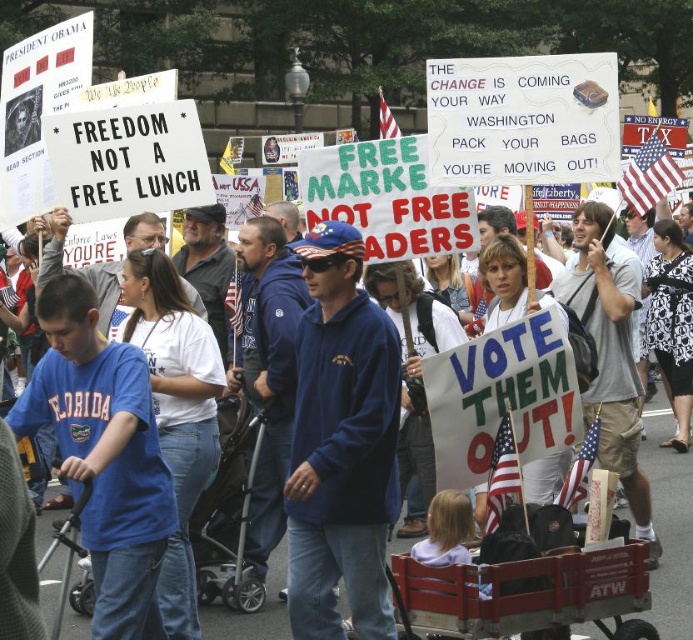
You are a photographer standing at the edge of the protest crowd. You want to take a photo that includes both the blue fleece jacket at center and the blue cotton shirt at center. The camera you have can focus on objects within a 3.5 meter range. Will both subjects be in focus?

The blue fleece jacket at center is 3.75 meters away from blue cotton shirt at center. Since the camera can only focus within 3.5 meters, the distance between them exceeds the focus range. Therefore, both subjects cannot be in focus simultaneously.

You are a photographer trying to capture a clear shot of the blue cotton shirt at center and the blue sweatshirt at center. Since both are at the center, which one is blocking the other?

The blue cotton shirt at center is in front of the blue sweatshirt at center, so it is blocking the view of the blue sweatshirt at center.

You are a photographer standing in front of the protest scene. You want to take a photo that includes both the point at (362,589) and the point at (672,470). Which point should you focus on first to ensure both are in sharp focus?

You should focus on the point at (362,589) first because it is closer to the camera than the point at (672,470). This way, the closer point will be in focus, and the farther point will also be within the depth of field.